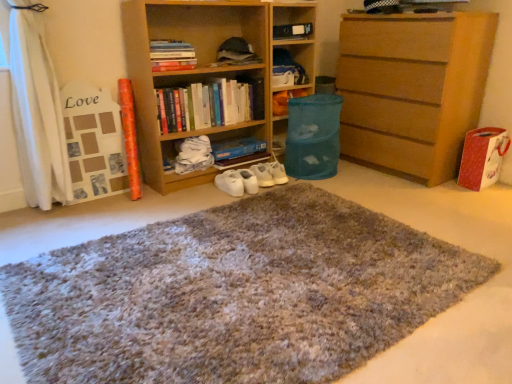
The height and width of the screenshot is (384, 512). Describe the element at coordinates (313, 136) in the screenshot. I see `blue fabric bean bag chair at center` at that location.

Identify the location of translucent plastic bin at center. (297, 37).

Locate an element on the screen. Image resolution: width=512 pixels, height=384 pixels. shaggy carpet at center is located at coordinates (234, 294).

Image resolution: width=512 pixels, height=384 pixels. I want to click on blue fabric bean bag chair at center, so click(x=313, y=136).

Is shaggy carpet at center a part of hardcover books at center, which is the second book from top to bottom?

No, hardcover books at center, which is the second book from top to bottom, does not contain shaggy carpet at center.

Measure the distance between hardcover books at center, which is the first book from bottom to top, and shaggy carpet at center.

They are 3.83 feet apart.

Is hardcover books at center, which is the second book from top to bottom, placed right next to shaggy carpet at center?

hardcover books at center, which is the second book from top to bottom, and shaggy carpet at center are not in contact.

Is blue fabric bean bag chair at center taller than shaggy carpet at center?

Yes, blue fabric bean bag chair at center is taller than shaggy carpet at center.

From the image's perspective, would you say blue fabric bean bag chair at center is positioned over shaggy carpet at center?

Yes, from the image's perspective, blue fabric bean bag chair at center is above shaggy carpet at center.

Is blue fabric bean bag chair at center to the left or to the right of shaggy carpet at center in the image?

From the image, it's evident that blue fabric bean bag chair at center is to the right of shaggy carpet at center.

How many degrees apart are the facing directions of blue fabric bean bag chair at center and shaggy carpet at center?

There is a 91.9-degree angle between the facing directions of blue fabric bean bag chair at center and shaggy carpet at center.

Is hardcover book at upper center, the second book when ordered from bottom to top, not inside light brown wooden chest of drawers at right?

That's correct, hardcover book at upper center, the second book when ordered from bottom to top, is outside of light brown wooden chest of drawers at right.

How far apart are hardcover book at upper center, arranged as the 1th book when viewed from the top, and light brown wooden chest of drawers at right?

hardcover book at upper center, arranged as the 1th book when viewed from the top, and light brown wooden chest of drawers at right are 4.39 feet apart from each other.

Can you confirm if hardcover book at upper center, the second book when ordered from bottom to top, is bigger than light brown wooden chest of drawers at right?

Actually, hardcover book at upper center, the second book when ordered from bottom to top, might be smaller than light brown wooden chest of drawers at right.

Which book is the 1st one when counting from the back of the light brown wooden chest of drawers at right? Please provide its 2D coordinates.

[(172, 55)]

Would you say wooden bookshelf at center contains hardcover books at center, which is the second book from top to bottom?

Yes, hardcover books at center, which is the second book from top to bottom, is inside wooden bookshelf at center.

From the image's perspective, which object appears higher, wooden bookshelf at center or hardcover books at center, which is the first book from bottom to top?

wooden bookshelf at center.

Which is in front, point (254, 21) or point (210, 122)?

Positioned in front is point (210, 122).

Can you confirm if wooden bookshelf at center is shorter than shaggy carpet at center?

Incorrect, the height of wooden bookshelf at center does not fall short of that of shaggy carpet at center.

Is wooden bookshelf at center directly adjacent to shaggy carpet at center?

They are not placed beside each other.

Choose the correct answer: Is wooden bookshelf at center inside shaggy carpet at center or outside it?

wooden bookshelf at center is spatially situated outside shaggy carpet at center.

Locate an element on the screen. The height and width of the screenshot is (384, 512). doormat lying in front of the wooden bookshelf at center is located at coordinates (234, 294).

Which of these two, hardcover book at upper center, the second book when ordered from bottom to top, or hardcover books at center, which is the second book from top to bottom, stands shorter?

Standing shorter between the two is hardcover book at upper center, the second book when ordered from bottom to top.

Based on the photo, is hardcover book at upper center, arranged as the 1th book when viewed from the top, facing towards hardcover books at center, which is the second book from top to bottom?

No, hardcover book at upper center, arranged as the 1th book when viewed from the top, is not aimed at hardcover books at center, which is the second book from top to bottom.

Does point (179, 54) lie in front of point (195, 98)?

Yes, it is.

Considering the positions of objects hardcover book at upper center, the second book when ordered from bottom to top, and hardcover books at center, which is the first book from bottom to top, in the image provided, who is behind, hardcover book at upper center, the second book when ordered from bottom to top, or hardcover books at center, which is the first book from bottom to top,?

hardcover books at center, which is the first book from bottom to top.

From a real-world perspective, is hardcover book at upper center, the second book when ordered from bottom to top, positioned above or below translucent plastic bin at center?

In terms of real-world spatial position, hardcover book at upper center, the second book when ordered from bottom to top, is above translucent plastic bin at center.

Can you tell me how much hardcover book at upper center, arranged as the 1th book when viewed from the top, and translucent plastic bin at center differ in facing direction?

There is a 0.32-degree angle between the facing directions of hardcover book at upper center, arranged as the 1th book when viewed from the top, and translucent plastic bin at center.

Which object is positioned more to the left, hardcover book at upper center, the second book when ordered from bottom to top, or translucent plastic bin at center?

Positioned to the left is hardcover book at upper center, the second book when ordered from bottom to top.

Between point (161, 44) and point (281, 23), which one is positioned behind?

The point (281, 23) is farther.

Find the location of a particular element. The height and width of the screenshot is (384, 512). doormat lying on the right of hardcover books at center, which is the first book from bottom to top is located at coordinates (234, 294).

The image size is (512, 384). In order to click on doormat lying in front of the blue fabric bean bag chair at center in this screenshot , I will do [x=234, y=294].

Consider the image. When comparing their distances from hardcover book at upper center, the second book when ordered from bottom to top, does blue fabric bean bag chair at center or hardcover books at center, which is the first book from bottom to top, seem closer?

hardcover books at center, which is the first book from bottom to top.

Estimate the real-world distances between objects in this image. Which object is further from light brown wooden chest of drawers at right, shaggy carpet at center or translucent plastic bin at center?

shaggy carpet at center is positioned further to the anchor light brown wooden chest of drawers at right.

Considering their positions, is hardcover book at upper center, the second book when ordered from bottom to top, positioned closer to light brown wooden chest of drawers at right than blue fabric bean bag chair at center?

Based on the image, blue fabric bean bag chair at center appears to be nearer to light brown wooden chest of drawers at right.

Which object lies further to the anchor point light brown wooden chest of drawers at right, white matte sneakers at center or translucent plastic bin at center?

Based on the image, white matte sneakers at center appears to be further to light brown wooden chest of drawers at right.

When comparing their distances from shaggy carpet at center, does light brown wooden chest of drawers at right or white matte sneakers at center seem further?

light brown wooden chest of drawers at right lies further to shaggy carpet at center than the other object.

When comparing their distances from hardcover book at upper center, arranged as the 1th book when viewed from the top, does hardcover books at center, which is the second book from top to bottom, or white matte sneakers at center seem closer?

The object closer to hardcover book at upper center, arranged as the 1th book when viewed from the top, is hardcover books at center, which is the second book from top to bottom.

Consider the image. Looking at the image, which one is located closer to translucent plastic bin at center, shaggy carpet at center or blue fabric bean bag chair at center?

blue fabric bean bag chair at center.

Based on their spatial positions, is translucent plastic bin at center or wooden bookshelf at center closer to hardcover books at center, which is the second book from top to bottom?

Among the two, wooden bookshelf at center is located nearer to hardcover books at center, which is the second book from top to bottom.

Locate an element on the screen. This screenshot has height=384, width=512. shelf between translucent plastic bin at center and white matte sneakers at center in the up-down direction is located at coordinates (204, 70).

Locate an element on the screen. bean bag chair between hardcover book at upper center, arranged as the 1th book when viewed from the top, and light brown wooden chest of drawers at right is located at coordinates (313, 136).

Identify the location of shelf between shaggy carpet at center and blue fabric bean bag chair at center along the z-axis. Image resolution: width=512 pixels, height=384 pixels. (204, 70).

The height and width of the screenshot is (384, 512). I want to click on the chest of drawers positioned between shaggy carpet at center and white matte sneakers at center from near to far, so click(412, 89).